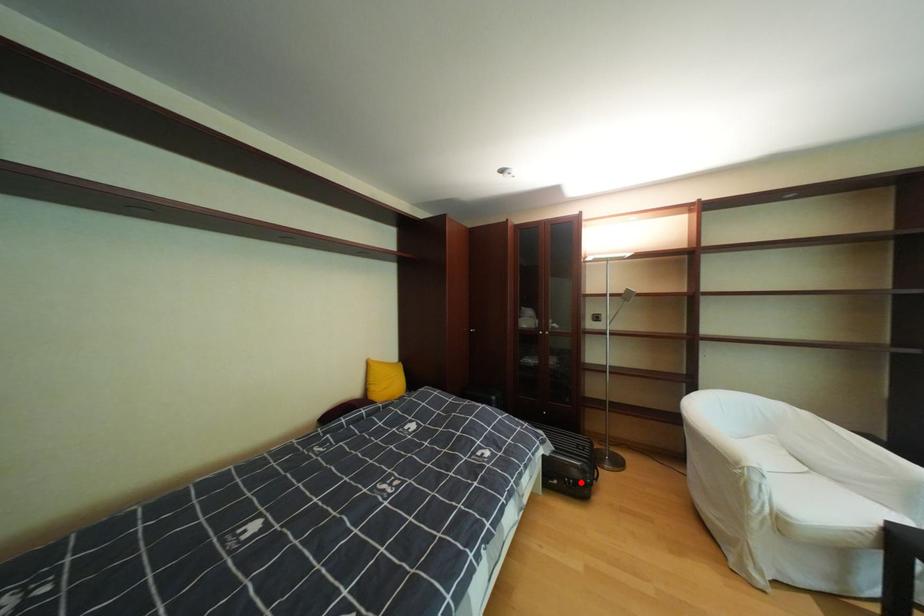
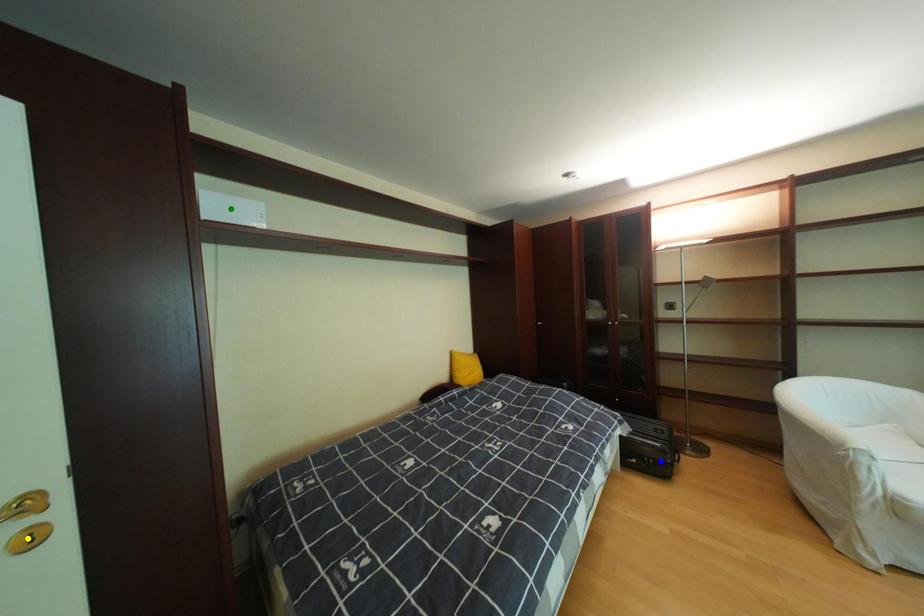
Question: I am providing you with two images of the same scene from different viewpoints. A red point is marked on the first image. You are given multiple points on the second image. Can you choose the point in image 2 that corresponds to the point in image 1?

Choices:
 (A) green point
 (B) yellow point
 (C) blue point

Answer: (C)